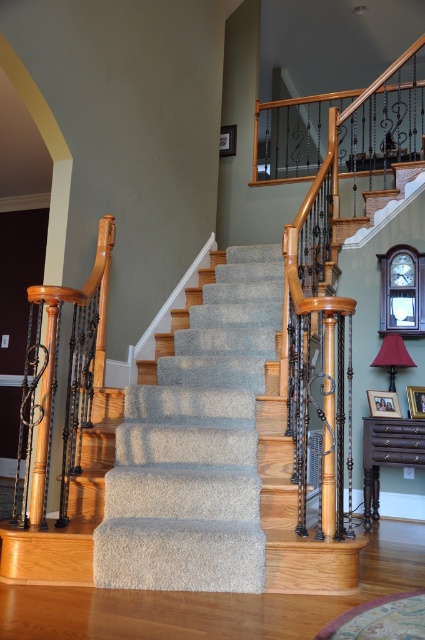
You are a delivery person carrying a large box and need to navigate the carpeted stairs at center while avoiding the matte red lampshade at right. Given their heights, which object will you have to look up to see?

The carpeted stairs at center has a greater height compared to the matte red lampshade at right, so you will have to look up to see the carpeted stairs at center.